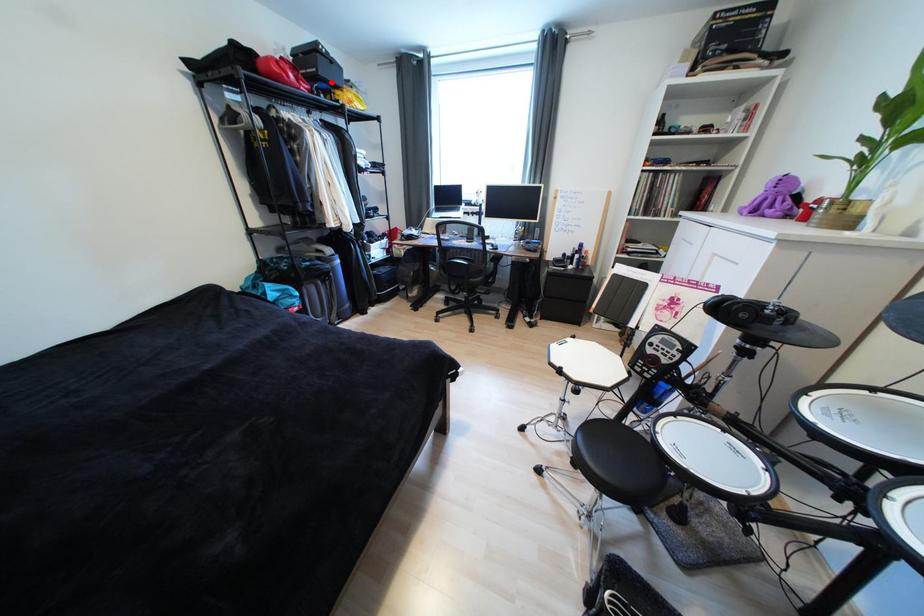
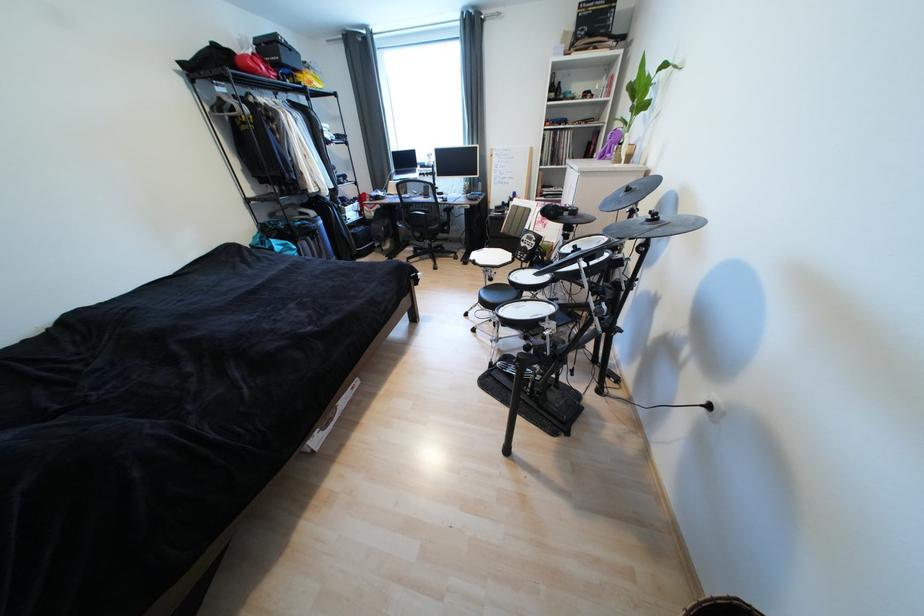
In the second image, find the point that corresponds to the highlighted location in the first image.

(294, 68)